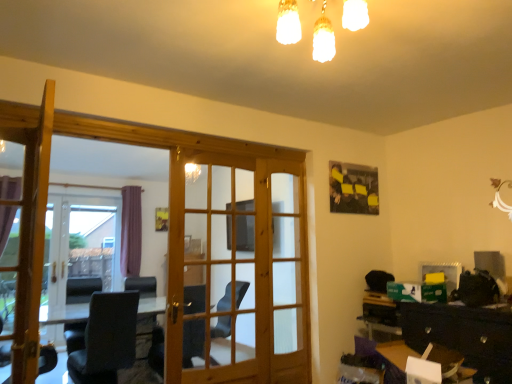
In order to face black glossy dresser at lower right, should I rotate leftwards or rightwards?

Rotate right and turn 26.711 degrees.

The height and width of the screenshot is (384, 512). What do you see at coordinates (238, 270) in the screenshot? I see `wooden door at center, which ranks as the 1th door in right-to-left order` at bounding box center [238, 270].

What do you see at coordinates (323, 38) in the screenshot?
I see `matte glass chandelier at upper center` at bounding box center [323, 38].

Locate an element on the screen. This screenshot has width=512, height=384. clear glass door at left, arranged as the 1th screen door when viewed from the left is located at coordinates (83, 242).

Where is `black glossy dresser at lower right`? The image size is (512, 384). black glossy dresser at lower right is located at coordinates (444, 336).

Which object is thinner, black glossy dresser at lower right or wooden door at left, marked as the 2th door in a right-to-left arrangement?

Thinner between the two is wooden door at left, marked as the 2th door in a right-to-left arrangement.

Which is correct: black glossy dresser at lower right is inside wooden door at left, the first door from the left, or outside of it?

black glossy dresser at lower right is outside wooden door at left, the first door from the left.

Which point is more forward, (397,361) or (18,370)?

The point (18,370) is in front.

Does black glossy dresser at lower right have a greater height compared to wooden door at left, the first door from the left?

In fact, black glossy dresser at lower right may be shorter than wooden door at left, the first door from the left.

Who is bigger, black glossy dresser at lower right or matte glass chandelier at upper center?

With larger size is black glossy dresser at lower right.

Are black glossy dresser at lower right and matte glass chandelier at upper center making contact?

There is a gap between black glossy dresser at lower right and matte glass chandelier at upper center.

Could you tell me if black glossy dresser at lower right is facing matte glass chandelier at upper center?

No, black glossy dresser at lower right is not facing towards matte glass chandelier at upper center.

Based on the photo, from the image's perspective, which one is positioned higher, black glossy dresser at lower right or matte glass chandelier at upper center?

matte glass chandelier at upper center.

In the scene shown: Can you confirm if clear glass door at left, the second screen door positioned from the right, is wider than matte glass chandelier at upper center?

In fact, clear glass door at left, the second screen door positioned from the right, might be narrower than matte glass chandelier at upper center.

Does point (63, 242) come farther from viewer compared to point (365, 10)?

Yes, it is.

Is clear glass door at left, the second screen door positioned from the right, looking in the opposite direction of matte glass chandelier at upper center?

No.

How many degrees apart are the facing directions of clear glass door at left, the 2th screen door from the front, and wooden door at left, the first door from the left?

They differ by 85 degrees in their facing directions.

Which of these two, clear glass door at left, the 2th screen door from the front, or wooden door at left, marked as the 2th door in a right-to-left arrangement, stands shorter?

wooden door at left, marked as the 2th door in a right-to-left arrangement, is shorter.

Is clear glass door at left, arranged as the 1th screen door when viewed from the left, closer to camera compared to wooden door at left, marked as the 2th door in a right-to-left arrangement?

That is False.

Is clear glass door at left, arranged as the 1th screen door when viewed from the left, positioned with its back to wooden door at left, the second door from the back?

No, wooden door at left, the second door from the back, is not at the back of clear glass door at left, arranged as the 1th screen door when viewed from the left.

Locate an element on the screen. The height and width of the screenshot is (384, 512). table lying on the left of black glossy dresser at lower right is located at coordinates (396, 356).

Considering the positions of objects black glossy dresser at lower right and wooden table at lower right in the image provided, who is behind, black glossy dresser at lower right or wooden table at lower right?

black glossy dresser at lower right is more distant.

Is black glossy dresser at lower right spatially inside wooden table at lower right, or outside of it?

black glossy dresser at lower right exists outside the volume of wooden table at lower right.

In terms of size, does black glossy dresser at lower right appear bigger or smaller than wooden table at lower right?

Considering their sizes, black glossy dresser at lower right takes up more space than wooden table at lower right.

Is point (68, 296) closer or farther from the camera than point (476, 342)?

Point (68, 296) is positioned farther from the camera compared to point (476, 342).

Can you confirm if clear glass door at left, the first screen door when ordered from back to front, is shorter than black glossy dresser at lower right?

No, clear glass door at left, the first screen door when ordered from back to front, is not shorter than black glossy dresser at lower right.

Does clear glass door at left, arranged as the 1th screen door when viewed from the left, have a larger size compared to black glossy dresser at lower right?

Yes, clear glass door at left, arranged as the 1th screen door when viewed from the left, is bigger than black glossy dresser at lower right.

Is clear glass door at left, the second screen door positioned from the right, beside matte wooden screen door at center, positioned as the second screen door in back-to-front order?

No, clear glass door at left, the second screen door positioned from the right, is not beside matte wooden screen door at center, positioned as the second screen door in back-to-front order.

Is clear glass door at left, arranged as the 1th screen door when viewed from the left, inside or outside of matte wooden screen door at center, acting as the 2th screen door starting from the left?

clear glass door at left, arranged as the 1th screen door when viewed from the left, is outside matte wooden screen door at center, acting as the 2th screen door starting from the left.

From the image's perspective, is clear glass door at left, the first screen door when ordered from back to front, above or below matte wooden screen door at center, which is the first screen door from front to back?

Based on their image positions, clear glass door at left, the first screen door when ordered from back to front, is located beneath matte wooden screen door at center, which is the first screen door from front to back.

There is a black glossy dresser at lower right. Identify the location of the 2nd door above it (from a real-world perspective). (30, 233).

You are a GUI agent. You are given a task and a screenshot of the screen. Output one action in this format:
    pyautogui.click(x=<x>, y=<y>)
    Task: Click on the dresser that appears behind the matte glass chandelier at upper center
    
    Given the screenshot: What is the action you would take?
    pyautogui.click(x=444, y=336)

Based on their spatial positions, is wooden door at center, which is counted as the 1th door, starting from the back, or black glossy dresser at lower right closer to wooden table at lower right?

black glossy dresser at lower right is closer to wooden table at lower right.

Which object lies further to the anchor point wooden table at lower right, wooden door at center, placed as the 2th door when sorted from left to right, or clear glass door at left, the first screen door when ordered from back to front?

Among the two, clear glass door at left, the first screen door when ordered from back to front, is located further to wooden table at lower right.

Based on the photo, from the image, which object appears to be nearer to matte wooden screen door at center, acting as the 2th screen door starting from the left, clear glass door at left, arranged as the 1th screen door when viewed from the left, or wooden door at left, the first door from the left?

Based on the image, wooden door at left, the first door from the left, appears to be nearer to matte wooden screen door at center, acting as the 2th screen door starting from the left.

Which object lies nearer to the anchor point wooden table at lower right, matte wooden screen door at center, positioned as the second screen door in back-to-front order, or wooden door at center, placed as the 2th door when sorted from left to right?

matte wooden screen door at center, positioned as the second screen door in back-to-front order.

Based on their spatial positions, is matte glass chandelier at upper center or black glossy dresser at lower right closer to wooden door at center, which is counted as the 1th door, starting from the back?

black glossy dresser at lower right lies closer to wooden door at center, which is counted as the 1th door, starting from the back, than the other object.

From the image, which object appears to be nearer to wooden door at left, the second door from the back, clear glass door at left, the first screen door when ordered from back to front, or wooden door at center, placed as the 2th door when sorted from left to right?

Among the two, wooden door at center, placed as the 2th door when sorted from left to right, is located nearer to wooden door at left, the second door from the back.

From the image, which object appears to be farther from wooden door at left, placed as the 1th door when sorted from front to back, wooden table at lower right or matte wooden screen door at center, which appears as the first screen door when viewed from the right?

The object further to wooden door at left, placed as the 1th door when sorted from front to back, is wooden table at lower right.

Considering their positions, is matte glass chandelier at upper center positioned further to wooden door at center, the second door viewed from the front, than wooden table at lower right?

matte glass chandelier at upper center is positioned further to the anchor wooden door at center, the second door viewed from the front.

Where is `door located between wooden door at left, marked as the 2th door in a right-to-left arrangement, and clear glass door at left, the 2th screen door from the front, in the depth direction`? The image size is (512, 384). door located between wooden door at left, marked as the 2th door in a right-to-left arrangement, and clear glass door at left, the 2th screen door from the front, in the depth direction is located at coordinates (238, 270).

This screenshot has width=512, height=384. In order to click on door situated between wooden door at left, the first door from the left, and black glossy dresser at lower right from left to right in this screenshot , I will do `click(238, 270)`.

Locate an element on the screen. The height and width of the screenshot is (384, 512). screen door between wooden door at center, placed as the 2th door when sorted from left to right, and wooden table at lower right, in the horizontal direction is located at coordinates (287, 273).

Where is `table situated between wooden door at center, placed as the 2th door when sorted from left to right, and black glossy dresser at lower right from left to right`? This screenshot has width=512, height=384. table situated between wooden door at center, placed as the 2th door when sorted from left to right, and black glossy dresser at lower right from left to right is located at coordinates (396, 356).